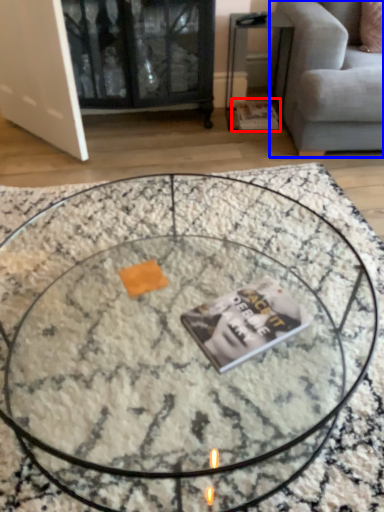
Question: Which of the following is the closest to the observer, magazine (highlighted by a red box) or studio couch (highlighted by a blue box)?

Choices:
 (A) magazine
 (B) studio couch

Answer: (B)